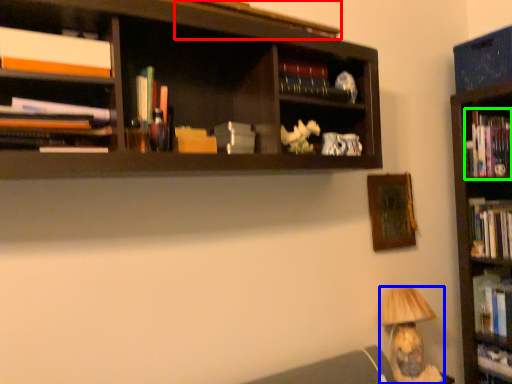
Question: Based on their relative distances, which object is farther from book (highlighted by a red box)? Choose from lamp (highlighted by a blue box) and book (highlighted by a green box).

Choices:
 (A) lamp
 (B) book

Answer: (A)